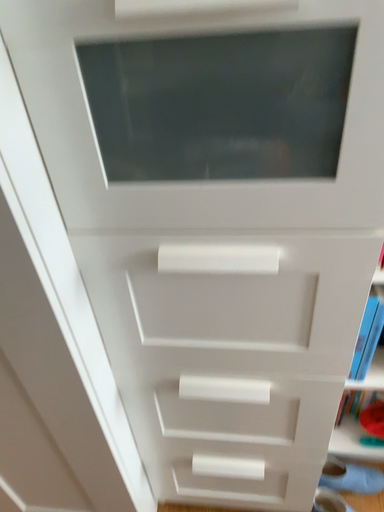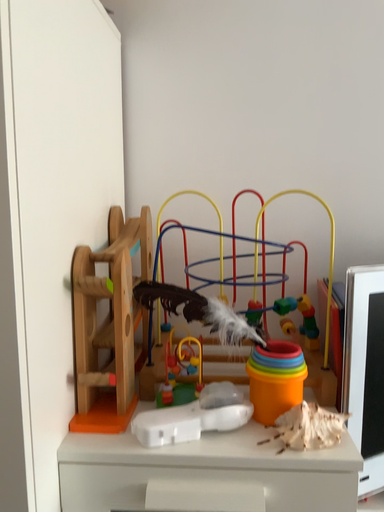
Question: Which way did the camera rotate in the video?

Choices:
 (A) rotated downward
 (B) rotated upward

Answer: (B)